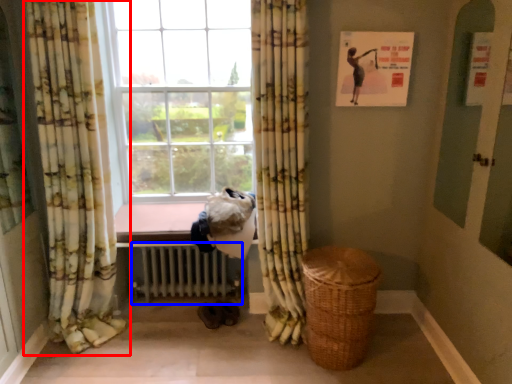
Question: Among these objects, which one is farthest to the camera, curtain (highlighted by a red box) or radiator (highlighted by a blue box)?

Choices:
 (A) curtain
 (B) radiator

Answer: (B)